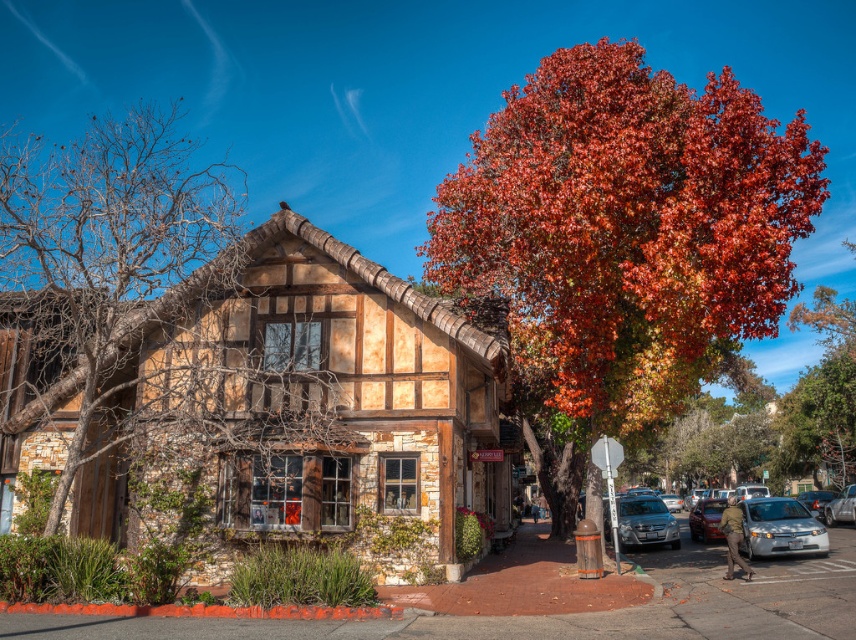
Question: Does vivid red leaves at upper right have a greater width compared to silver metallic sedan at lower right?

Choices:
 (A) no
 (B) yes

Answer: (B)

Question: Observing the image, what is the correct spatial positioning of vivid red leaves at upper right in reference to silver metallic sedan at lower right?

Choices:
 (A) right
 (B) left

Answer: (A)

Question: Is vivid red leaves at upper right bigger than shiny silver sedan at center right?

Choices:
 (A) no
 (B) yes

Answer: (B)

Question: Which point is farther from the camera taking this photo?

Choices:
 (A) (718, 520)
 (B) (771, 554)

Answer: (A)

Question: Among these points, which one is nearest to the camera?

Choices:
 (A) (742, 540)
 (B) (736, 244)

Answer: (B)

Question: Which point is closer to the camera taking this photo?

Choices:
 (A) (785, 532)
 (B) (703, 532)
 (C) (111, 449)

Answer: (A)